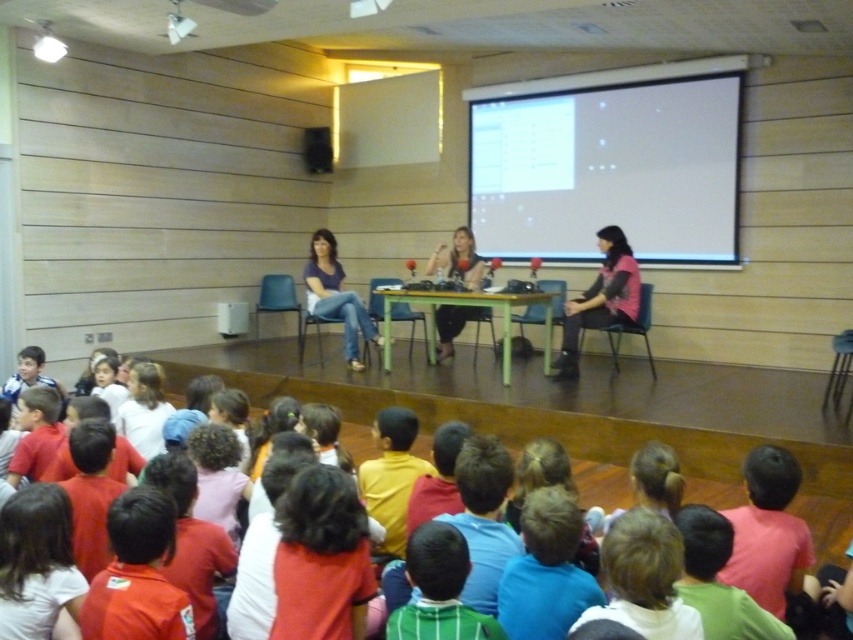
Is white matte projection screen at upper center thinner than matte black table at center?

No.

Between point (718, 227) and point (440, 342), which one is positioned in front?

Point (718, 227) is in front.

Who is more forward, [636,93] or [445,339]?

Point [445,339] is in front.

Find the location of a particular element. This screenshot has height=640, width=853. white matte projection screen at upper center is located at coordinates (608, 170).

Which is more to the left, matte blue jeans at center or matte black table at center?

matte blue jeans at center

Does matte blue jeans at center appear on the left side of matte black table at center?

Correct, you'll find matte blue jeans at center to the left of matte black table at center.

Who is more forward, (318, 243) or (460, 240)?

Positioned in front is point (460, 240).

Identify the location of matte blue jeans at center. (335, 296).

Between pink fabric shirt at center and matte blue jeans at center, which one has more height?

With more height is matte blue jeans at center.

Is pink fabric shirt at center further to camera compared to matte blue jeans at center?

No, pink fabric shirt at center is closer to the viewer.

Identify the location of pink fabric shirt at center. The height and width of the screenshot is (640, 853). (601, 300).